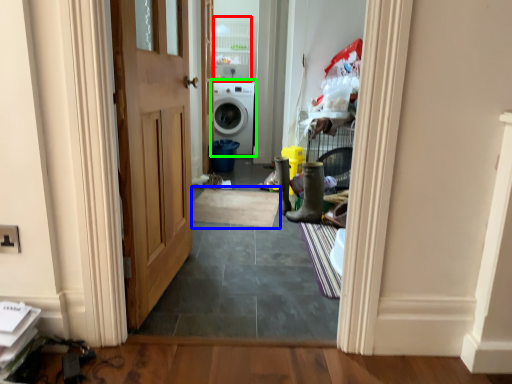
Question: Which object is positioned closest to cabinetry (highlighted by a red box)? Select from doormat (highlighted by a blue box) and washing machine (highlighted by a green box).

Choices:
 (A) doormat
 (B) washing machine

Answer: (B)